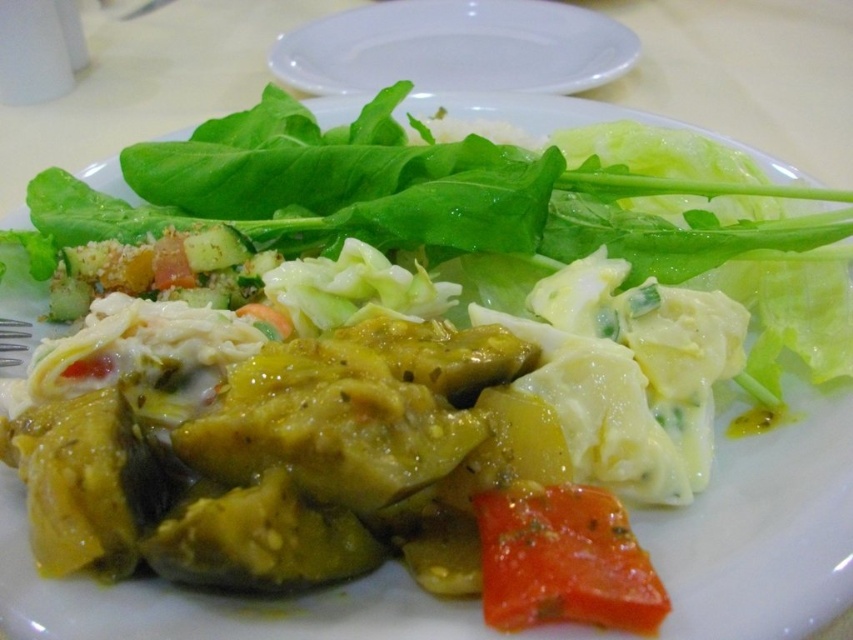
Question: In this image, where is white plastic plate at upper center located relative to glossy red tomato at lower center?

Choices:
 (A) right
 (B) left

Answer: (B)

Question: Is white plastic plate at upper center wider than glossy red tomato at lower center?

Choices:
 (A) yes
 (B) no

Answer: (A)

Question: Is white plastic plate at upper center bigger than glossy red tomato at lower center?

Choices:
 (A) yes
 (B) no

Answer: (A)

Question: Which point is farther to the camera?

Choices:
 (A) white plastic plate at upper center
 (B) glossy red tomato at lower center

Answer: (A)